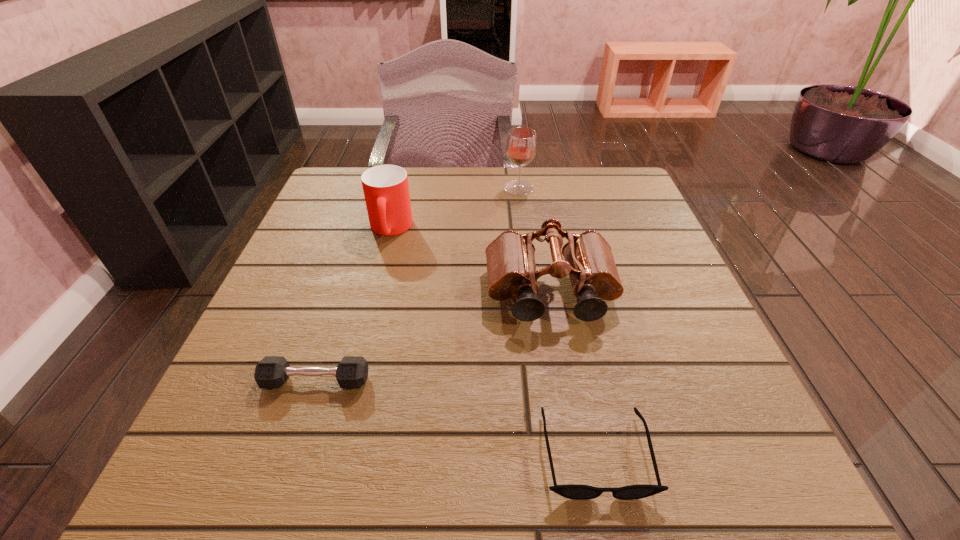
Locate an element on the screen. free point between the farthest object and the binoculars is located at coordinates (535, 241).

The width and height of the screenshot is (960, 540). Identify the location of vacant area that lies between the third farthest object and the dumbbell. (433, 337).

In order to click on free space between the fourth farthest object and the second farthest object in this screenshot , I will do coord(353,305).

The image size is (960, 540). What are the coordinates of `free spot between the cup and the second nearest object` in the screenshot? It's located at (353, 305).

At what (x,y) coordinates should I click in order to perform the action: click on unoccupied area between the wineglass and the binoculars. Please return your answer as a coordinate pair (x, y). Looking at the image, I should click on (535, 241).

You are a GUI agent. You are given a task and a screenshot of the screen. Output one action in this format:
    pyautogui.click(x=<x>, y=<y>)
    Task: Click on the object that is the fourth closest to the third nearest object
    This screenshot has width=960, height=540.
    Given the screenshot: What is the action you would take?
    pyautogui.click(x=521, y=146)

In order to click on the fourth closest object to the second farthest object in this screenshot , I will do [573, 491].

At what (x,y) coordinates should I click in order to perform the action: click on vacant space that satisfies the following two spatial constraints: 1. on the back side of the tallest object; 2. on the left side of the dumbbell. Please return your answer as a coordinate pair (x, y). The width and height of the screenshot is (960, 540). Looking at the image, I should click on (379, 188).